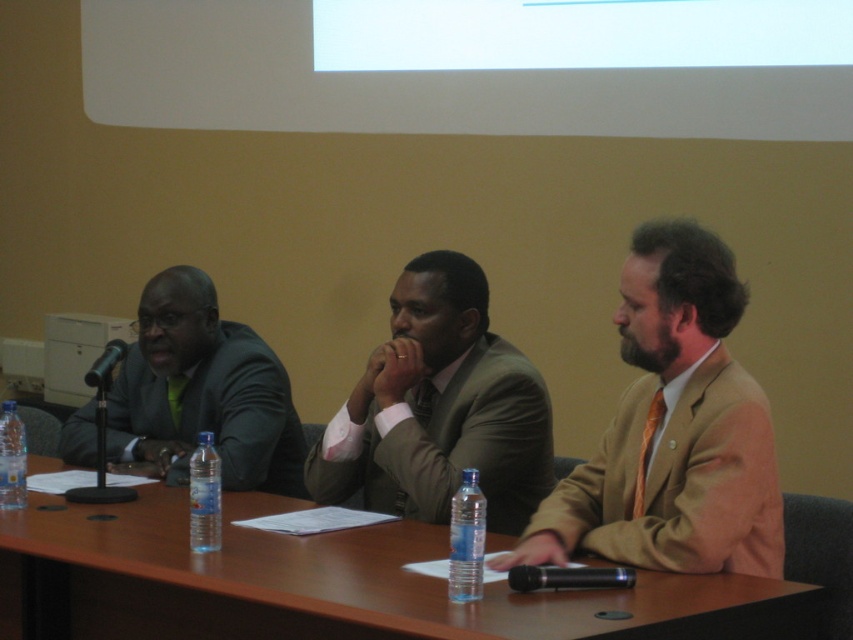
You are a guest at this panel discussion and need to grab a drink. There are two bottles on the table. Which one is easier to reach without moving your chair? Please choose between the transparent plastic water bottle at center and the clear plastic bottle at table center.

The transparent plastic water bottle at center is closer to the viewer than the clear plastic bottle at table center, so it is easier to reach without moving your chair.

You are organizing a conference and need to ensure that the matte green suit at center and the clear plastic water bottle at table left are visible in the photo. Which object should you focus on to capture both in the frame?

The matte green suit at center is bigger than the clear plastic water bottle at table left, so focusing on the matte green suit at center will ensure both are visible in the frame.